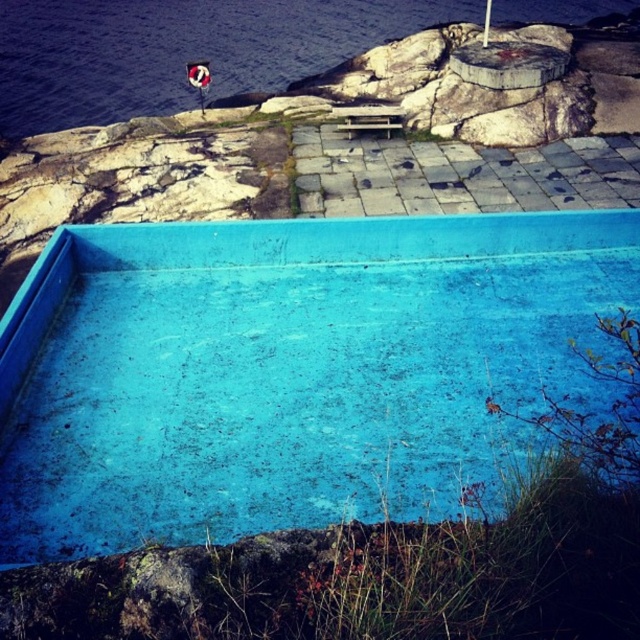
You are standing at the edge of the blue concrete water at upper left and want to walk to the blue matte pool at center. Which direction should you move to reach it?

The blue matte pool at center is located to the right of the blue concrete water at upper left, so you should move to your right to reach it.